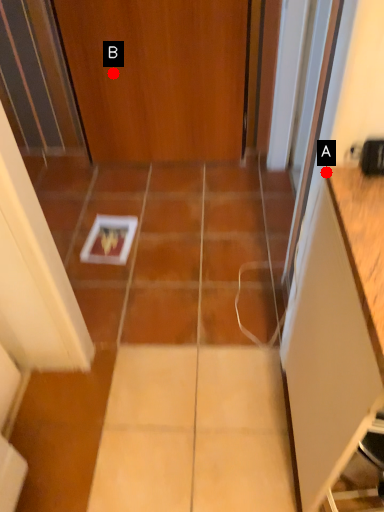
Question: Two points are circled on the image, labeled by A and B beside each circle. Which point is farther to the camera?

Choices:
 (A) A is further
 (B) B is further

Answer: (B)